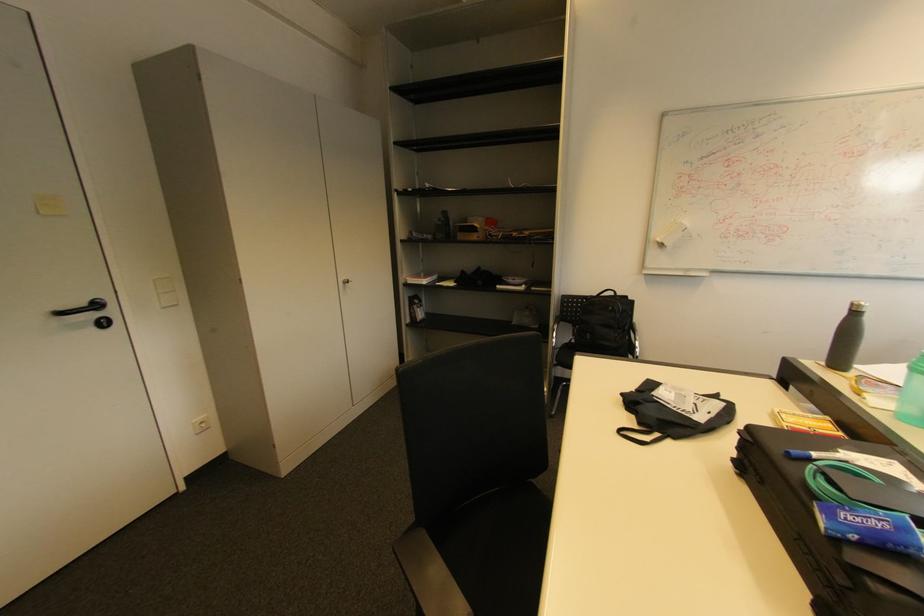
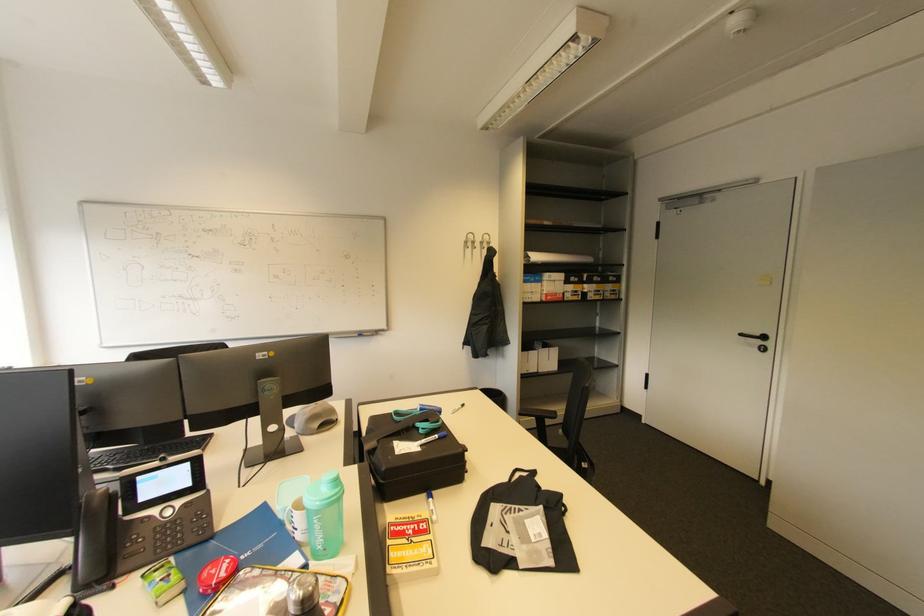
Locate, in the second image, the point that corresponds to the point at 677,400 in the first image.

(531, 523)